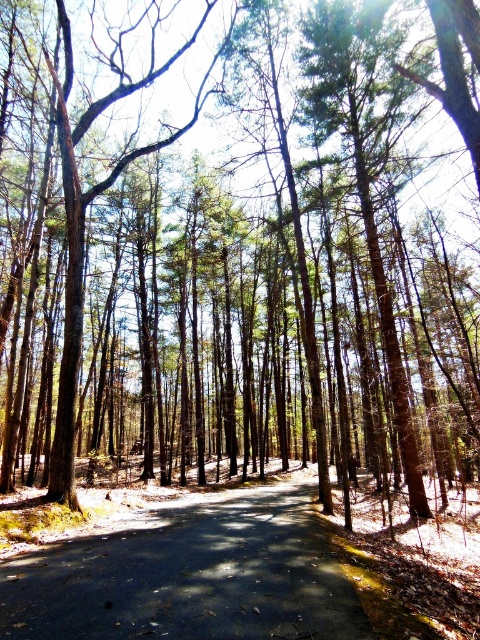
Question: Can you confirm if dark asphalt road at center is positioned to the left of brown textured tree at center?

Choices:
 (A) no
 (B) yes

Answer: (A)

Question: Which point is closer to the camera taking this photo?

Choices:
 (A) (305, 602)
 (B) (75, 282)

Answer: (A)

Question: Among these objects, which one is farthest from the camera?

Choices:
 (A) dark asphalt road at center
 (B) brown textured tree at center

Answer: (B)

Question: Can you confirm if dark asphalt road at center is thinner than brown textured tree at center?

Choices:
 (A) no
 (B) yes

Answer: (B)

Question: Does dark asphalt road at center come in front of brown textured tree at center?

Choices:
 (A) yes
 (B) no

Answer: (A)